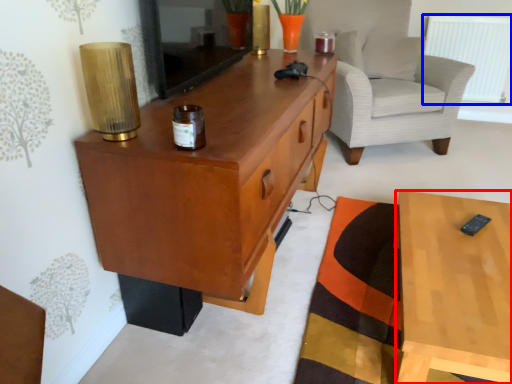
Question: Which object appears closest to the camera in this image, desk (highlighted by a red box) or radiator (highlighted by a blue box)?

Choices:
 (A) desk
 (B) radiator

Answer: (A)